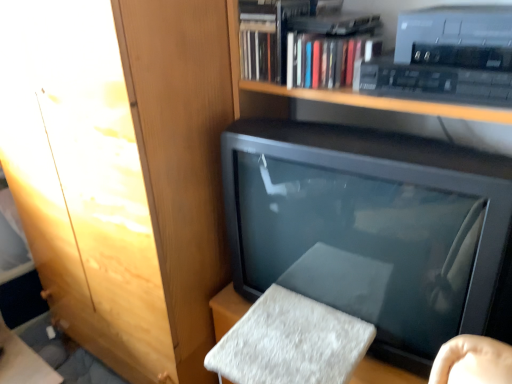
Question: Does hardcover book at upper center appear on the left side of wooden cabinet at upper left?

Choices:
 (A) yes
 (B) no

Answer: (B)

Question: Is wooden cabinet at upper left a part of hardcover book at upper center?

Choices:
 (A) yes
 (B) no

Answer: (B)

Question: Considering the relative positions of hardcover book at upper center and wooden cabinet at upper left in the image provided, is hardcover book at upper center to the right of wooden cabinet at upper left from the viewer's perspective?

Choices:
 (A) no
 (B) yes

Answer: (B)

Question: Does hardcover book at upper center have a smaller size compared to wooden cabinet at upper left?

Choices:
 (A) yes
 (B) no

Answer: (A)

Question: From the image's perspective, does hardcover book at upper center appear higher than wooden cabinet at upper left?

Choices:
 (A) yes
 (B) no

Answer: (A)

Question: Is hardcover book at upper center touching wooden cabinet at upper left?

Choices:
 (A) yes
 (B) no

Answer: (B)

Question: From the image's perspective, does wooden cabinet at upper left appear higher than hardcover book at upper center?

Choices:
 (A) no
 (B) yes

Answer: (A)

Question: Is wooden cabinet at upper left to the left of hardcover book at upper center from the viewer's perspective?

Choices:
 (A) no
 (B) yes

Answer: (B)

Question: Is wooden cabinet at upper left touching hardcover book at upper center?

Choices:
 (A) no
 (B) yes

Answer: (A)

Question: Could you tell me if wooden cabinet at upper left is facing hardcover book at upper center?

Choices:
 (A) no
 (B) yes

Answer: (A)

Question: Is wooden cabinet at upper left not inside hardcover book at upper center?

Choices:
 (A) yes
 (B) no

Answer: (A)

Question: Is the depth of wooden cabinet at upper left greater than that of hardcover book at upper center?

Choices:
 (A) yes
 (B) no

Answer: (B)

Question: Is wooden cabinet at upper left positioned with its back to matte black television at center?

Choices:
 (A) no
 (B) yes

Answer: (A)